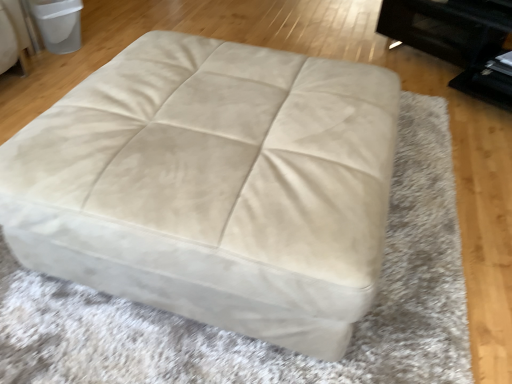
Question: Does beige suede ottoman at center appear on the right side of beige suede ottoman at upper left?

Choices:
 (A) no
 (B) yes

Answer: (B)

Question: Is beige suede ottoman at center turned away from beige suede ottoman at upper left?

Choices:
 (A) yes
 (B) no

Answer: (B)

Question: Is beige suede ottoman at center far away from beige suede ottoman at upper left?

Choices:
 (A) yes
 (B) no

Answer: (A)

Question: Can you confirm if beige suede ottoman at center is taller than beige suede ottoman at upper left?

Choices:
 (A) no
 (B) yes

Answer: (B)

Question: Considering the relative sizes of beige suede ottoman at center and beige suede ottoman at upper left in the image provided, is beige suede ottoman at center thinner than beige suede ottoman at upper left?

Choices:
 (A) yes
 (B) no

Answer: (B)

Question: Is the depth of beige suede ottoman at center less than that of beige suede ottoman at upper left?

Choices:
 (A) no
 (B) yes

Answer: (B)

Question: Considering the relative sizes of beige suede ottoman at upper left and beige suede ottoman at center in the image provided, is beige suede ottoman at upper left taller than beige suede ottoman at center?

Choices:
 (A) yes
 (B) no

Answer: (B)

Question: Is beige suede ottoman at upper left not inside beige suede ottoman at center?

Choices:
 (A) yes
 (B) no

Answer: (A)

Question: Can you confirm if beige suede ottoman at upper left is positioned to the right of beige suede ottoman at center?

Choices:
 (A) no
 (B) yes

Answer: (A)

Question: Is beige suede ottoman at upper left wider than beige suede ottoman at center?

Choices:
 (A) no
 (B) yes

Answer: (A)

Question: Is beige suede ottoman at center at the back of beige suede ottoman at upper left?

Choices:
 (A) no
 (B) yes

Answer: (A)

Question: Is beige suede ottoman at upper left touching beige suede ottoman at center?

Choices:
 (A) yes
 (B) no

Answer: (B)

Question: Considering the positions of point (287, 254) and point (49, 39), is point (287, 254) closer or farther from the camera than point (49, 39)?

Choices:
 (A) farther
 (B) closer

Answer: (B)